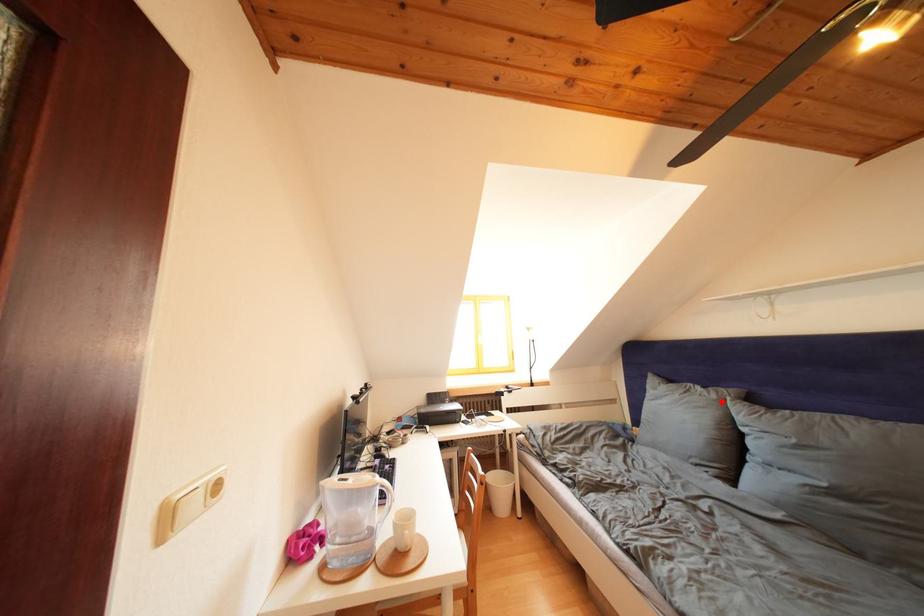
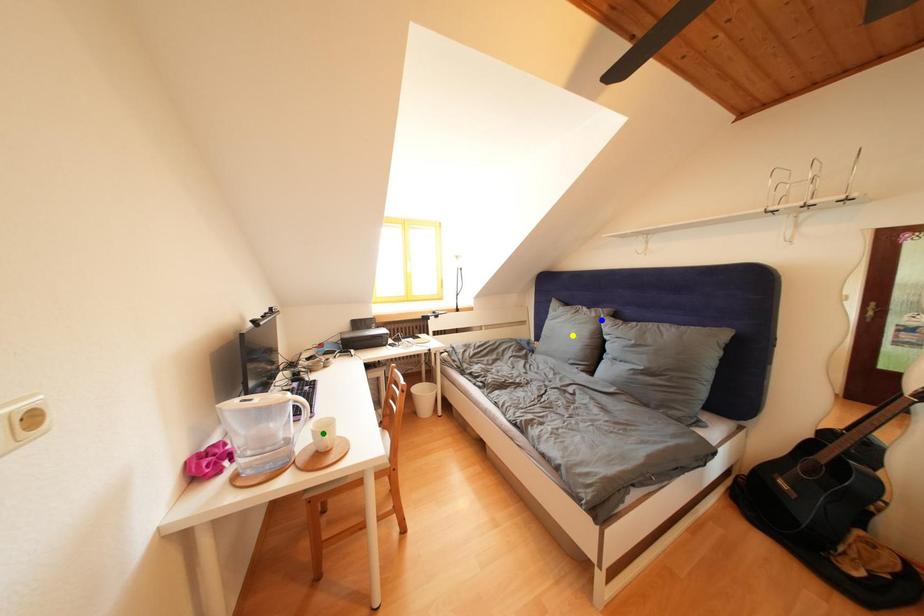
Question: I am providing you with two images of the same scene from different viewpoints. A red point is marked on the first image. You are given multiple points on the second image. Can you choose the point in image 2 that corresponds to the point in image 1?

Choices:
 (A) yellow point
 (B) blue point
 (C) green point

Answer: (B)